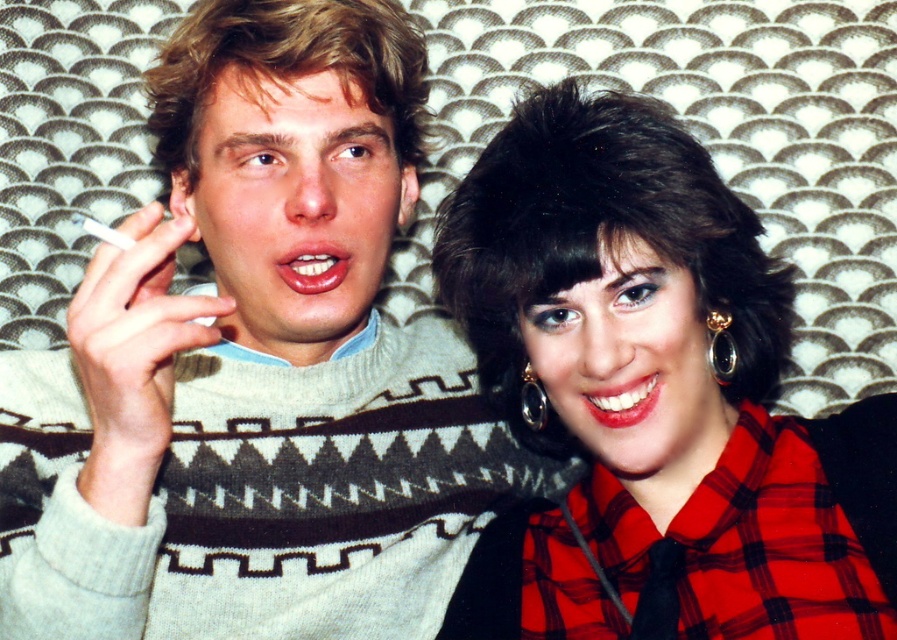
You are a photographer who needs to ensure that both the red plaid shirt at center and the black shiny earring at upper right are fully visible in the frame. Based on their sizes, which one might require you to adjust the camera angle to fit into the shot?

The red plaid shirt at center might require adjusting the camera angle because it is wider than the black shiny earring at upper right, so it could take up more space in the frame.

You are a photographer adjusting the lighting for a photo shoot. You notice the red plaid shirt at center and the gold metallic earring at upper right. Which object is positioned lower in the frame?

The red plaid shirt at center is located below the gold metallic earring at upper right, so the red plaid shirt at center is positioned lower in the frame.

You are a photographer trying to capture a closeup of the gold metallic earring at upper right and the black shiny earring at upper right. Your camera can only focus on one earring at a time. Which earring should you focus on to ensure it is fully in frame if the camera has a narrower field of view?

The gold metallic earring at upper right might be wider than the black shiny earring at upper right, so focusing on the gold metallic earring at upper right would be better to ensure it fits within the camera frame.